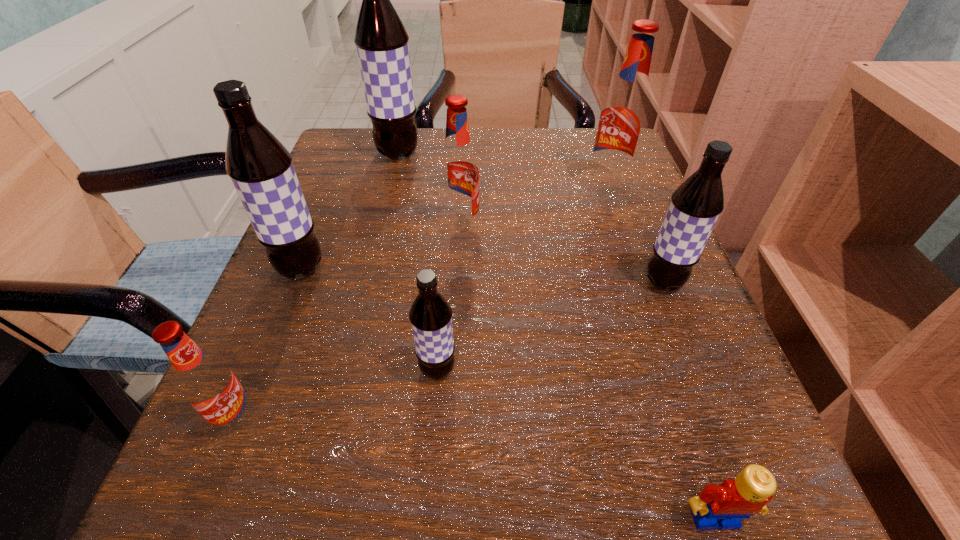
Locate an element on the screen. This screenshot has width=960, height=540. empty space that is in between the smallest red root beer and the second brown root beer from right to left is located at coordinates [338, 395].

Locate an element on the screen. This screenshot has width=960, height=540. free space between the third biggest brown root beer and the farthest red root beer is located at coordinates (636, 234).

Select which object appears as the fifth closest to the second biggest brown root beer. Please provide its 2D coordinates. Your answer should be formatted as a tuple, i.e. [(x, y)], where the tuple contains the x and y coordinates of a point satisfying the conditions above.

[(623, 119)]

Identify which object is located as the seventh nearest to the rightmost red root beer. Please provide its 2D coordinates. Your answer should be formatted as a tuple, i.e. [(x, y)], where the tuple contains the x and y coordinates of a point satisfying the conditions above.

[(207, 383)]

Identify which root beer is located as the sixth nearest to the smallest brown root beer. Please provide its 2D coordinates. Your answer should be formatted as a tuple, i.e. [(x, y)], where the tuple contains the x and y coordinates of a point satisfying the conditions above.

[(381, 40)]

Locate an element on the screen. The height and width of the screenshot is (540, 960). root beer that can be found as the fourth closest to the red Lego is located at coordinates (207, 383).

Point out which brown root beer is positioned as the nearest to the third smallest brown root beer. Please provide its 2D coordinates. Your answer should be formatted as a tuple, i.e. [(x, y)], where the tuple contains the x and y coordinates of a point satisfying the conditions above.

[(430, 315)]

At what (x,y) coordinates should I click in order to perform the action: click on brown root beer that is the third closest to the third smallest brown root beer. Please return your answer as a coordinate pair (x, y). Looking at the image, I should click on (695, 206).

The image size is (960, 540). I want to click on the third closest red root beer to the third brown root beer from right to left, so click(x=207, y=383).

Select which red root beer appears as the second closest to the second farthest object. Please provide its 2D coordinates. Your answer should be formatted as a tuple, i.e. [(x, y)], where the tuple contains the x and y coordinates of a point satisfying the conditions above.

[(207, 383)]